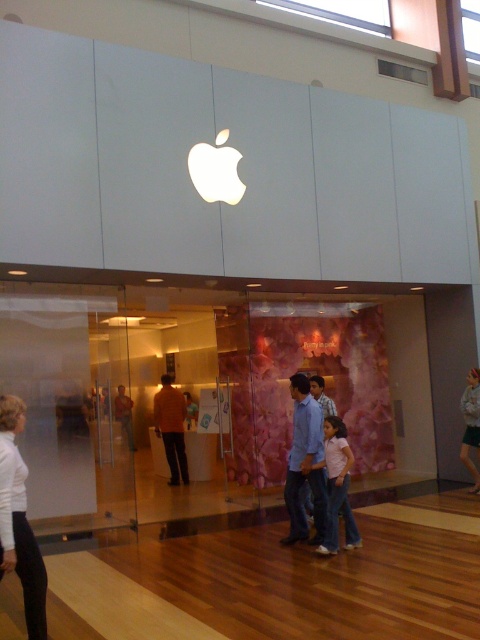
Does light blue jeans at center lie in front of orange shirt at center?

No.

Which is more to the left, light blue jeans at center or orange shirt at center?

orange shirt at center is more to the left.

Which is behind, point (464, 397) or point (126, 419)?

The point (464, 397) is behind.

The image size is (480, 640). What are the coordinates of `light blue jeans at center` in the screenshot? It's located at (470, 424).

This screenshot has height=640, width=480. I want to click on pink cotton shirt at center, so (x=336, y=486).

Between point (340, 490) and point (477, 486), which one is positioned in front?

Point (340, 490)

Locate an element on the screen. pink cotton shirt at center is located at coordinates (336, 486).

Is blue jeans at center above light blue jeans at center?

Yes.

Between point (302, 520) and point (460, 445), which one is positioned behind?

The point (460, 445) is more distant.

Does point (314, 435) come in front of point (463, 451)?

That is True.

What are the coordinates of `blue jeans at center` in the screenshot? It's located at (304, 464).